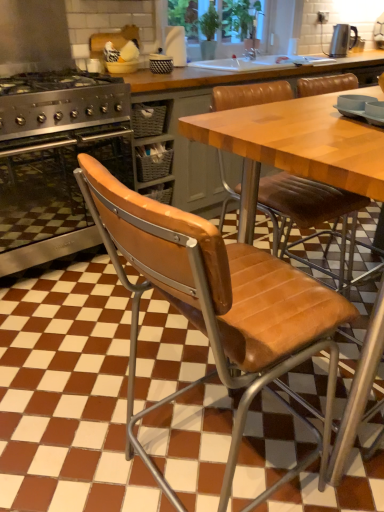
Question: Is metallic silver kettle at upper right looking in the opposite direction of brown leather chair at center?

Choices:
 (A) no
 (B) yes

Answer: (A)

Question: Does metallic silver kettle at upper right come in front of brown leather chair at center?

Choices:
 (A) yes
 (B) no

Answer: (B)

Question: Is brown leather chair at center surrounded by metallic silver kettle at upper right?

Choices:
 (A) yes
 (B) no

Answer: (B)

Question: Is metallic silver kettle at upper right aimed at brown leather chair at center?

Choices:
 (A) yes
 (B) no

Answer: (B)

Question: From a real-world perspective, is metallic silver kettle at upper right on brown leather chair at center?

Choices:
 (A) no
 (B) yes

Answer: (B)

Question: Based on their sizes in the image, would you say metallic silver kettle at upper right is bigger or smaller than stainless steel oven at left?

Choices:
 (A) big
 (B) small

Answer: (B)

Question: Is metallic silver kettle at upper right taller or shorter than stainless steel oven at left?

Choices:
 (A) short
 (B) tall

Answer: (A)

Question: Would you say metallic silver kettle at upper right is inside or outside stainless steel oven at left?

Choices:
 (A) inside
 (B) outside

Answer: (B)

Question: From a real-world perspective, is metallic silver kettle at upper right above or below stainless steel oven at left?

Choices:
 (A) below
 (B) above

Answer: (B)

Question: Relative to stainless steel oven at left, is brown leather chair at center in front or behind?

Choices:
 (A) behind
 (B) front

Answer: (B)

Question: From a real-world perspective, is brown leather chair at center physically located above or below stainless steel oven at left?

Choices:
 (A) below
 (B) above

Answer: (B)

Question: Is brown leather chair at center situated inside stainless steel oven at left or outside?

Choices:
 (A) inside
 (B) outside

Answer: (B)

Question: From the image's perspective, is brown leather chair at center positioned above or below stainless steel oven at left?

Choices:
 (A) above
 (B) below

Answer: (B)

Question: From their relative heights in the image, would you say wooden table at center is taller or shorter than metallic silver kettle at upper right?

Choices:
 (A) short
 (B) tall

Answer: (B)

Question: Is wooden table at center inside the boundaries of metallic silver kettle at upper right, or outside?

Choices:
 (A) outside
 (B) inside

Answer: (A)